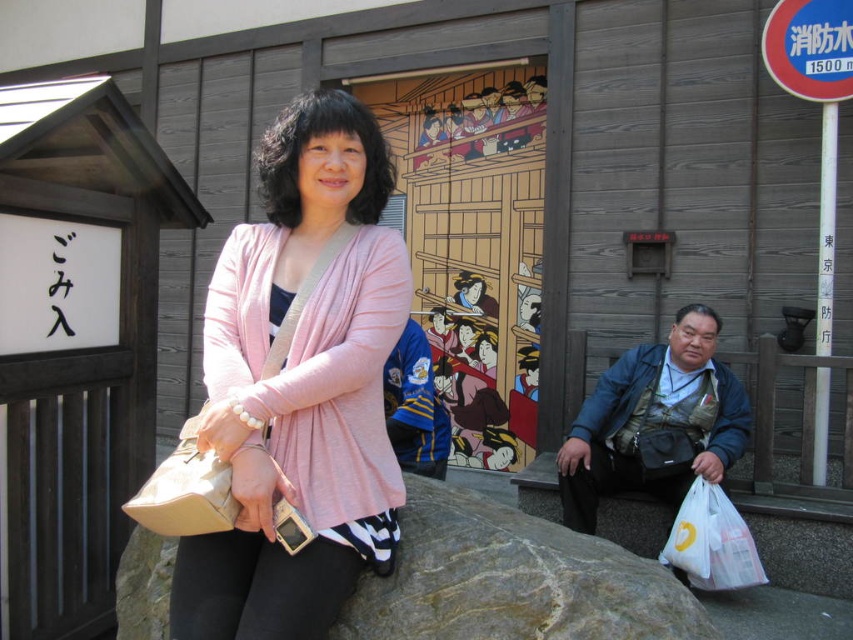
Question: Which point is closer to the camera?

Choices:
 (A) gray rough stone at center
 (B) pink fabric sweater at center

Answer: (B)

Question: Can you confirm if pink fabric sweater at center is positioned above beige fabric bag at center?

Choices:
 (A) yes
 (B) no

Answer: (A)

Question: Is pink fabric sweater at center wider than beige fabric bag at center?

Choices:
 (A) yes
 (B) no

Answer: (A)

Question: Which point appears closest to the camera in this image?

Choices:
 (A) (708, 529)
 (B) (213, 481)
 (C) (308, 96)

Answer: (B)

Question: Is beige fabric bag at center further to the viewer compared to white plastic bag at lower right?

Choices:
 (A) yes
 (B) no

Answer: (B)

Question: Which object is closer to the camera taking this photo?

Choices:
 (A) beige fabric bag at center
 (B) gray rough stone at center
 (C) white plastic bag at lower right

Answer: (A)